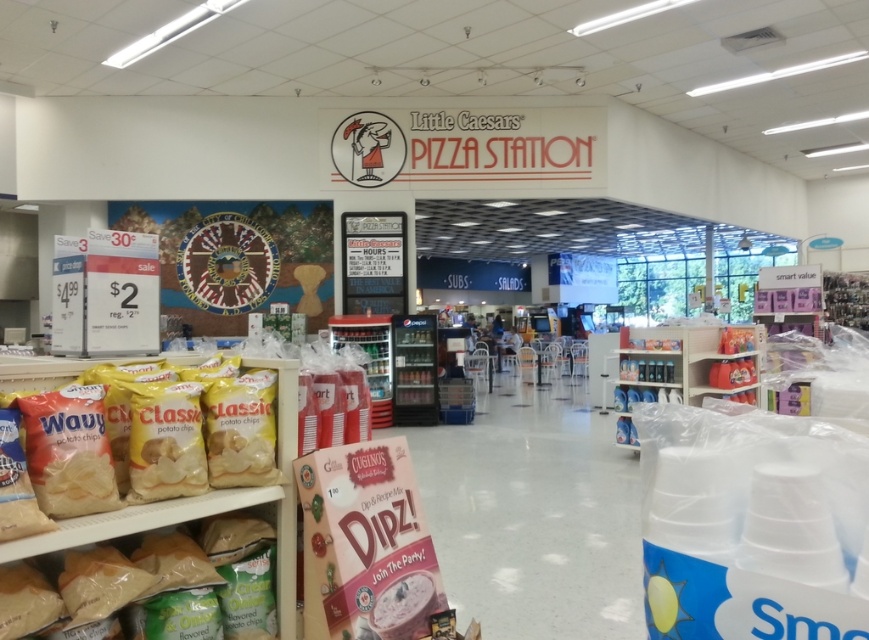
You are standing in front of the Little Caesars Pizza Station and want to reach the two points marked in the scene. Which point, point (180, 531) or point (45, 360), is closer to you?

Point (180, 531) is closer to you than point (45, 360).

You are a customer looking for the Cugini Dip. You see the translucent plastic bag of chips at lower left and the yellow matte potato chips at left. Which of these items is positioned to the right of the other?

The yellow matte potato chips at left are to the right of the translucent plastic bag of chips at lower left.

You are a customer in the store and want to grab both the translucent plastic bag of chips at lower left and the yellow matte potato chips at left. How far apart are they?

The translucent plastic bag of chips at lower left is 6.85 inches from the yellow matte potato chips at left.